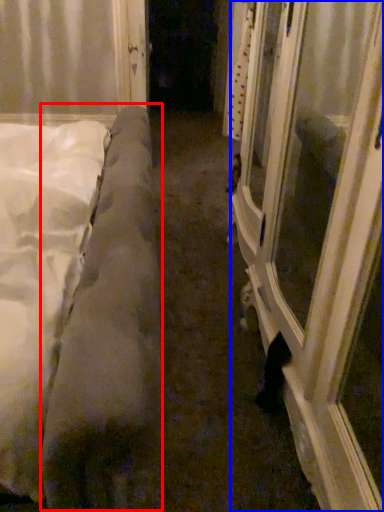
Question: Which point is further to the camera, mattress (highlighted by a red box) or window frame (highlighted by a blue box)?

Choices:
 (A) mattress
 (B) window frame

Answer: (B)